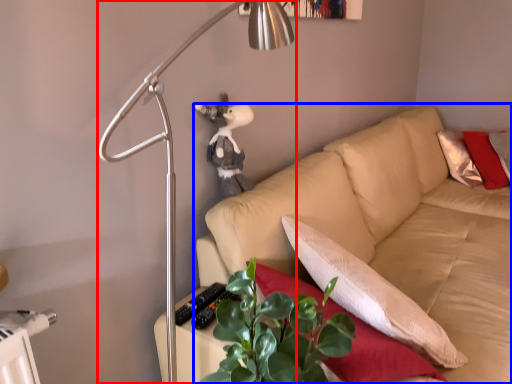
Question: Among these objects, which one is farthest to the camera, lamp (highlighted by a red box) or studio couch (highlighted by a blue box)?

Choices:
 (A) lamp
 (B) studio couch

Answer: (B)